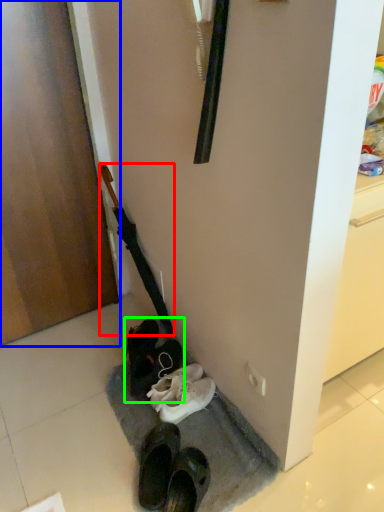
Question: Which object is positioned farthest from umbrella (highlighted by a red box)? Select from door (highlighted by a blue box) and footwear (highlighted by a green box).

Choices:
 (A) door
 (B) footwear

Answer: (A)